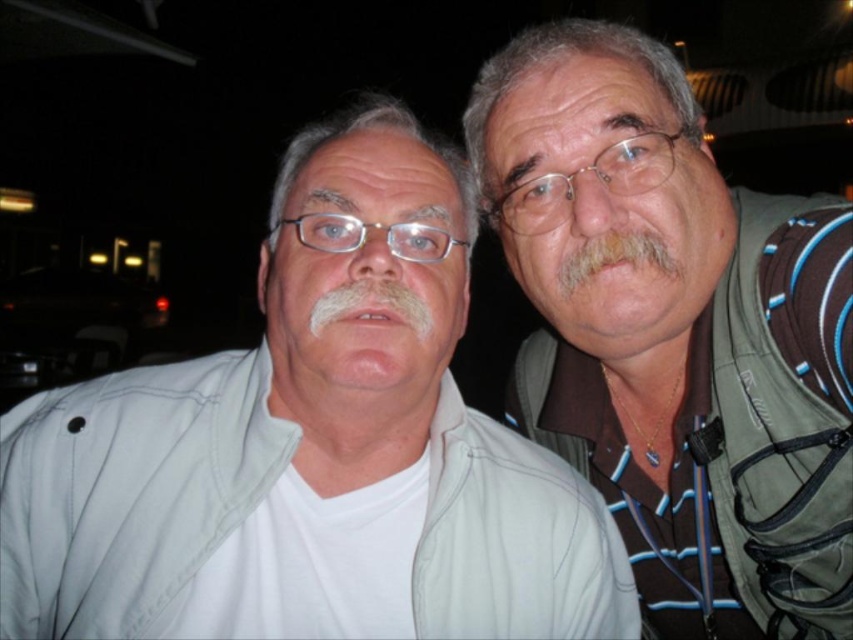
You are standing in front of the two people in the photo. You want to touch the point closer to you between the two points labeled as point (300, 218) and point (596, 237). Which point should you aim for?

You should aim for point (300, 218) because it is closer to you than point (596, 237).

You are a photographer trying to frame a closeup shot of both the clear plastic glasses at center and the white fuzzy beard at center. Which object should you focus on first if you want to ensure the taller one is in sharp focus?

The white fuzzy beard at center is taller than the clear plastic glasses at center, so you should focus on the white fuzzy beard at center first to ensure it is in sharp focus.

You are a photographer setting up for a group photo. You notice the green fabric vest at right and the clear plastic glasses at center in the scene. To ensure both items are in focus, what is the minimum distance you need to adjust the camera focus between them?

The minimum distance you need to adjust the camera focus between the green fabric vest at right and the clear plastic glasses at center is 15.57 inches.